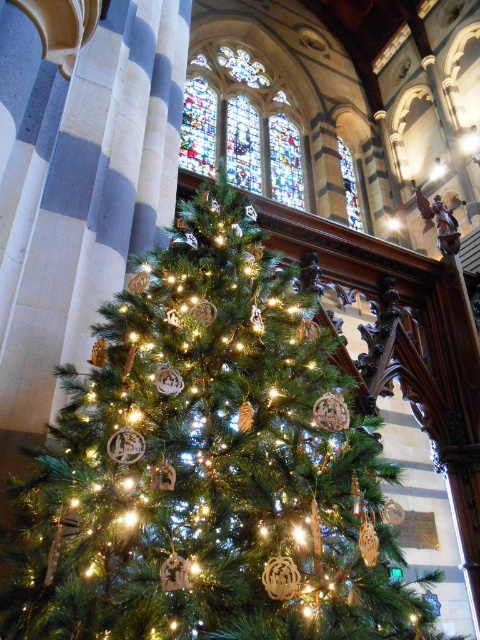
You are standing in the church and want to take a photo of both the green matte christmas tree at center and the stained glass at upper center. Which object should you focus on first if you want to ensure both are in the frame without moving your camera?

The green matte christmas tree at center is smaller than the stained glass at upper center. To include both in the frame, focus on the stained glass at upper center first since it is larger and occupies more space, then adjust the camera angle slightly downward to include the smaller tree at the center.